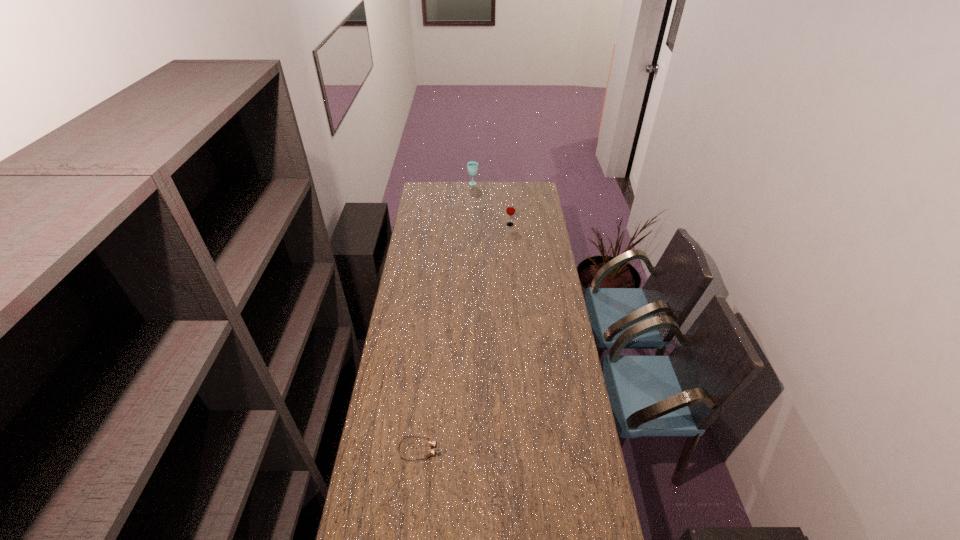
Where is `object that can be found as the second closest to the right glass`? Image resolution: width=960 pixels, height=540 pixels. object that can be found as the second closest to the right glass is located at coordinates (432, 443).

You are a GUI agent. You are given a task and a screenshot of the screen. Output one action in this format:
    pyautogui.click(x=<x>, y=<y>)
    Task: Click on the second closest glass to the goggles
    Image resolution: width=960 pixels, height=540 pixels.
    Given the screenshot: What is the action you would take?
    pos(472,166)

Locate an element on the screen. The height and width of the screenshot is (540, 960). free location that satisfies the following two spatial constraints: 1. on the front side of the second object from right to left; 2. on the left side of the nearer glass is located at coordinates (472, 225).

I want to click on blank space that satisfies the following two spatial constraints: 1. on the front side of the farther glass; 2. on the front lenses and sides of the goggles, so click(467, 450).

This screenshot has width=960, height=540. Find the location of `vacant area that satisfies the following two spatial constraints: 1. on the front side of the second farthest object; 2. on the left side of the farther glass`. vacant area that satisfies the following two spatial constraints: 1. on the front side of the second farthest object; 2. on the left side of the farther glass is located at coordinates (472, 225).

This screenshot has height=540, width=960. Identify the location of free space that satisfies the following two spatial constraints: 1. on the front side of the second object from left to right; 2. on the front lenses and sides of the nearest object. (467, 450).